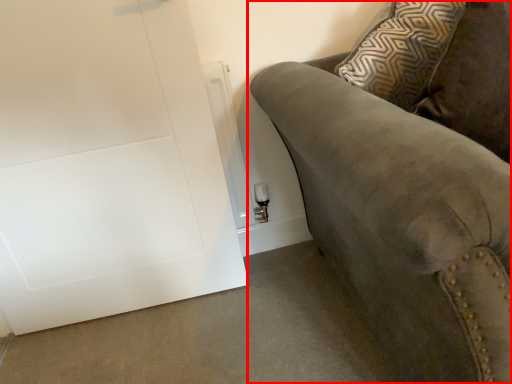
Question: From the image's perspective, what is the correct spatial positioning of studio couch (annotated by the red box) in reference to door?

Choices:
 (A) below
 (B) above

Answer: (A)